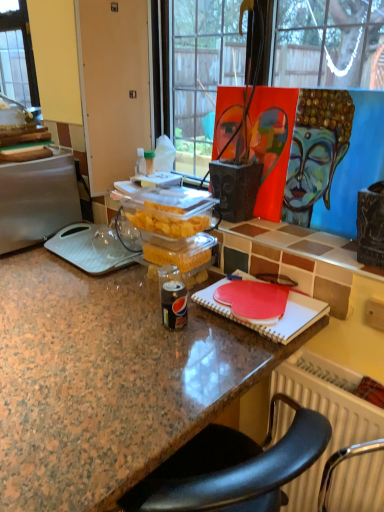
Question: Is granite countertop at center at the back of silver metallic fridge at left?

Choices:
 (A) no
 (B) yes

Answer: (A)

Question: Is silver metallic fridge at left facing towards granite countertop at center?

Choices:
 (A) yes
 (B) no

Answer: (B)

Question: From a real-world perspective, is silver metallic fridge at left positioned under granite countertop at center based on gravity?

Choices:
 (A) no
 (B) yes

Answer: (A)

Question: Can you confirm if silver metallic fridge at left is smaller than granite countertop at center?

Choices:
 (A) yes
 (B) no

Answer: (A)

Question: Is silver metallic fridge at left positioned beyond the bounds of granite countertop at center?

Choices:
 (A) yes
 (B) no

Answer: (A)

Question: From a real-world perspective, relative to silver metallic fridge at left, is granite countertop at center vertically above or below?

Choices:
 (A) above
 (B) below

Answer: (B)

Question: From the image's perspective, is granite countertop at center located above or below silver metallic fridge at left?

Choices:
 (A) above
 (B) below

Answer: (B)

Question: Is granite countertop at center inside the boundaries of silver metallic fridge at left, or outside?

Choices:
 (A) outside
 (B) inside

Answer: (A)

Question: Considering their positions, is granite countertop at center located in front of or behind silver metallic fridge at left?

Choices:
 (A) front
 (B) behind

Answer: (A)

Question: Considering the positions of granite countertop at center and painted canvas at upper right in the image, is granite countertop at center taller or shorter than painted canvas at upper right?

Choices:
 (A) short
 (B) tall

Answer: (B)

Question: From a real-world perspective, is granite countertop at center positioned above or below painted canvas at upper right?

Choices:
 (A) below
 (B) above

Answer: (A)

Question: Visually, is granite countertop at center positioned to the left or to the right of painted canvas at upper right?

Choices:
 (A) right
 (B) left

Answer: (B)

Question: Is granite countertop at center spatially inside painted canvas at upper right, or outside of it?

Choices:
 (A) outside
 (B) inside

Answer: (A)

Question: Is silver metallic fridge at left bigger or smaller than granite countertop at center?

Choices:
 (A) small
 (B) big

Answer: (A)

Question: From a real-world perspective, relative to granite countertop at center, is silver metallic fridge at left vertically above or below?

Choices:
 (A) above
 (B) below

Answer: (A)